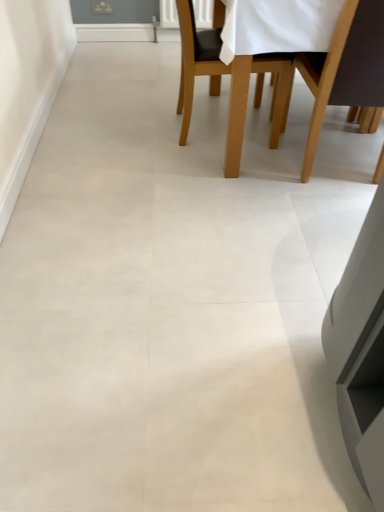
Find the location of a particular element. This screenshot has height=512, width=384. free area behind light brown wooden chair at upper center, acting as the 2th chair starting from the right is located at coordinates (195, 95).